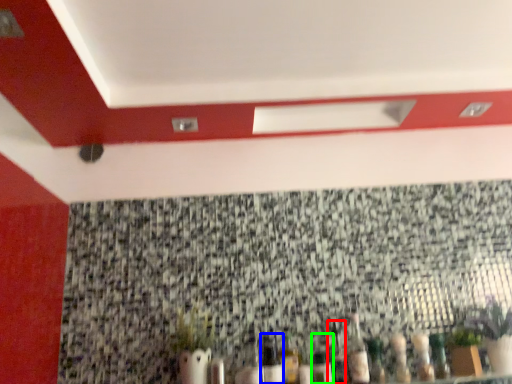
Question: Which object is positioned farthest from bottle (highlighted by a red box)? Select from bottle (highlighted by a blue box) and bottle (highlighted by a green box).

Choices:
 (A) bottle
 (B) bottle

Answer: (A)